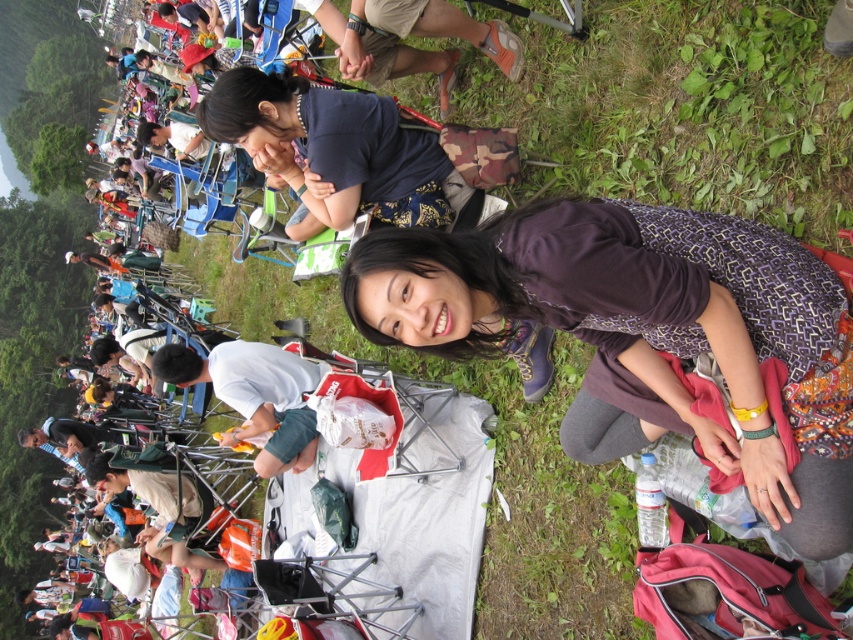
Question: Is purple printed dress at center positioned before white cotton shirt at lower left?

Choices:
 (A) yes
 (B) no

Answer: (A)

Question: Does purple printed dress at center appear over dark blue fabric at center?

Choices:
 (A) yes
 (B) no

Answer: (B)

Question: Does purple printed dress at center appear over dark blue fabric at center?

Choices:
 (A) yes
 (B) no

Answer: (B)

Question: Which object is the farthest from the purple printed dress at center?

Choices:
 (A) white cotton shirt at lower left
 (B) dark blue fabric at center

Answer: (A)

Question: Which point is farther to the camera?

Choices:
 (A) dark blue fabric at center
 (B) purple printed dress at center

Answer: (A)

Question: Considering the real-world distances, which object is farthest from the white cotton shirt at lower left?

Choices:
 (A) purple printed dress at center
 (B) dark blue fabric at center

Answer: (A)